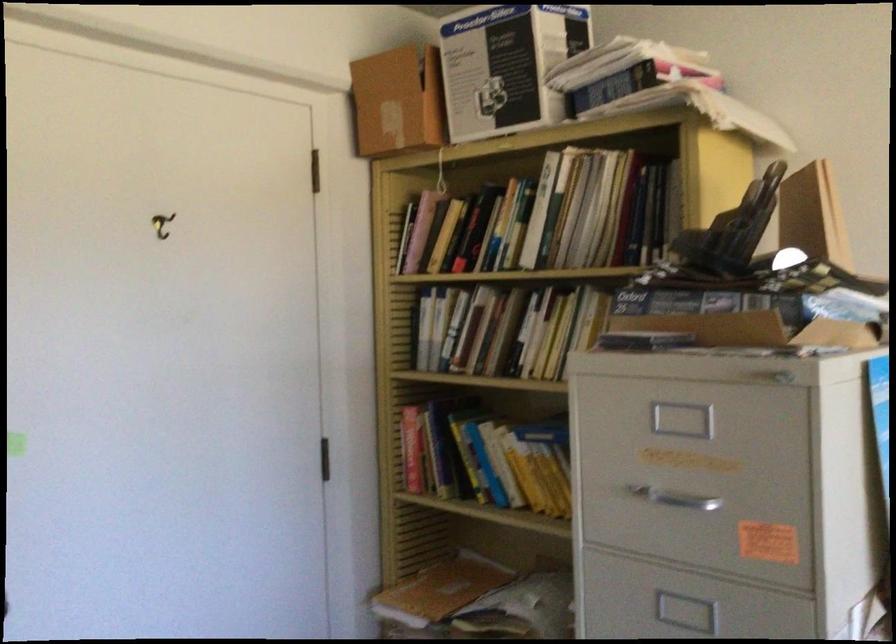
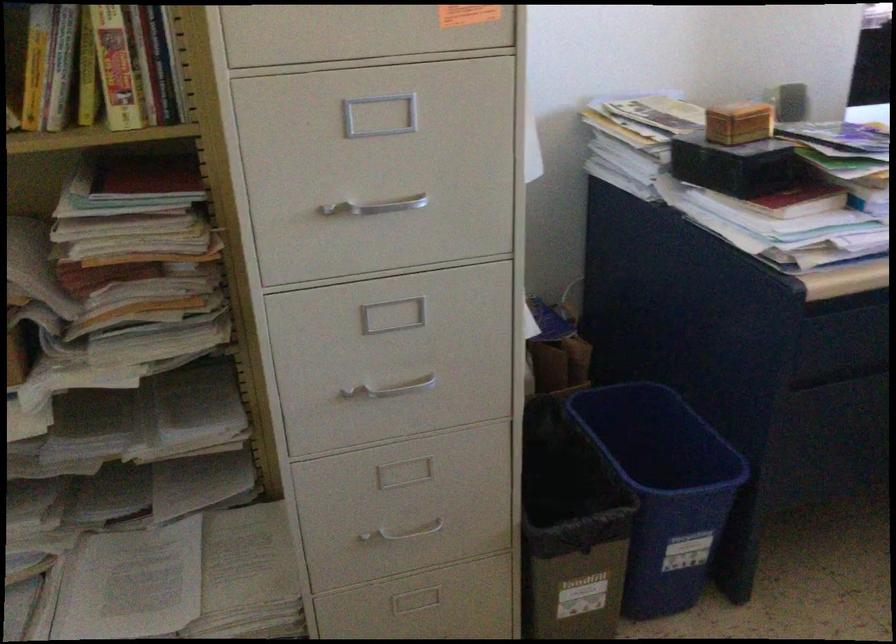
Consider the image. The images are taken continuously from a first-person perspective. In which direction is your viewpoint rotating?

The rotation direction of the camera is right-down.